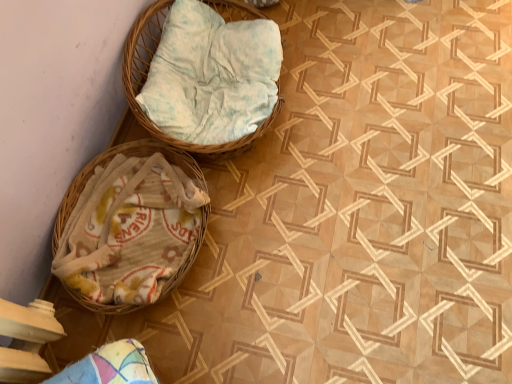
Find the location of a particular element. The height and width of the screenshot is (384, 512). free space in front of woven wicker basket at upper center, marked as the 2th basket in a bottom-to-top arrangement is located at coordinates (295, 228).